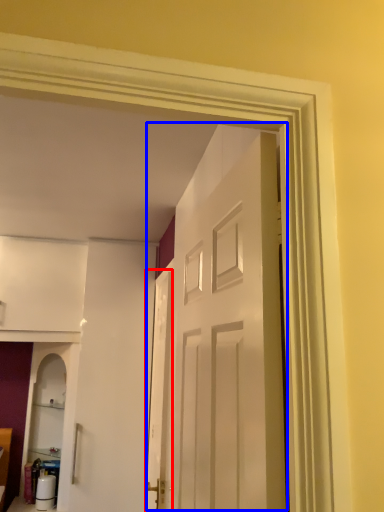
Question: Which of the following is the closest to the observer, screen door (highlighted by a red box) or door (highlighted by a blue box)?

Choices:
 (A) screen door
 (B) door

Answer: (B)